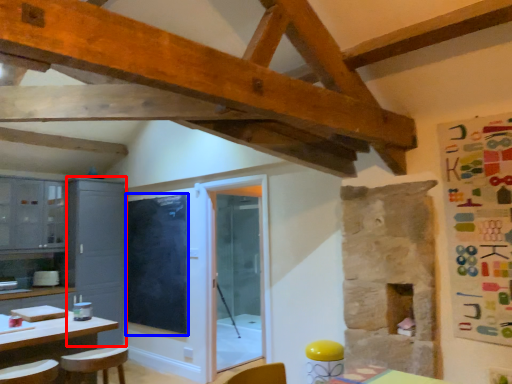
Question: Which of the following is the closest to the observer, cabinetry (highlighted by a red box) or window screen (highlighted by a blue box)?

Choices:
 (A) cabinetry
 (B) window screen

Answer: (B)